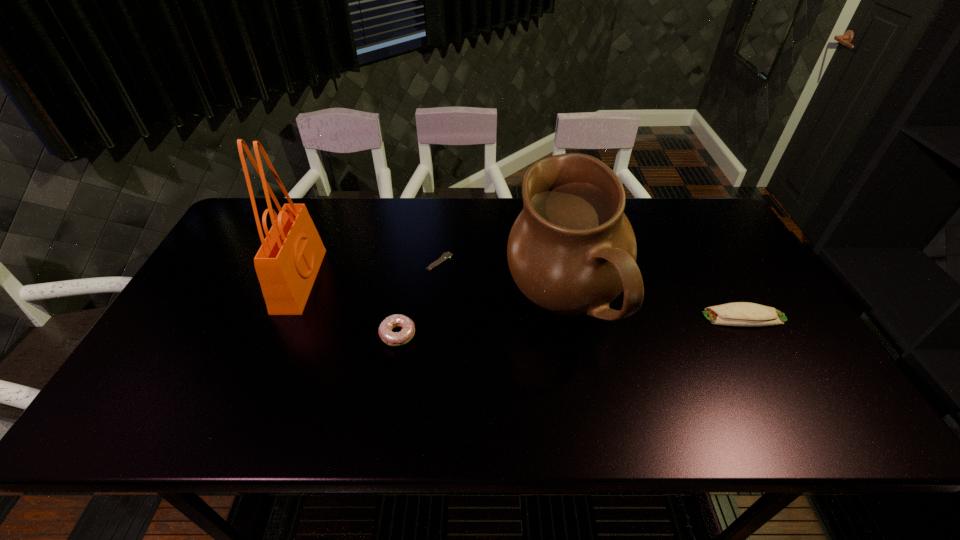
At what (x,y) coordinates should I click in order to perform the action: click on vacant space at the near edge. Please return your answer as a coordinate pair (x, y). Image resolution: width=960 pixels, height=540 pixels. Looking at the image, I should click on 255,420.

Identify the location of vacant space at the left edge. (180, 312).

At what (x,y) coordinates should I click in order to perform the action: click on vacant space at the near left corner of the desktop. Please return your answer as a coordinate pair (x, y). Looking at the image, I should click on (157, 429).

Image resolution: width=960 pixels, height=540 pixels. Find the location of `unoccupied area between the watch and the leftmost object`. unoccupied area between the watch and the leftmost object is located at coordinates (370, 271).

This screenshot has height=540, width=960. I want to click on free space between the rightmost object and the third shortest object, so click(571, 326).

This screenshot has height=540, width=960. Find the location of `vacant area that lies between the leftmost object and the fourth object from right to left`. vacant area that lies between the leftmost object and the fourth object from right to left is located at coordinates (348, 307).

Find the location of a particular element. free spot between the second object from right to left and the shortest object is located at coordinates (502, 284).

Where is `free space between the tote bag and the burrito`? This screenshot has height=540, width=960. free space between the tote bag and the burrito is located at coordinates (521, 299).

Locate an element on the screen. The height and width of the screenshot is (540, 960). empty space that is in between the burrito and the fourth object from right to left is located at coordinates (571, 326).

Find the location of a particular element. The width and height of the screenshot is (960, 540). free space between the fourth object from left to right and the tote bag is located at coordinates (432, 293).